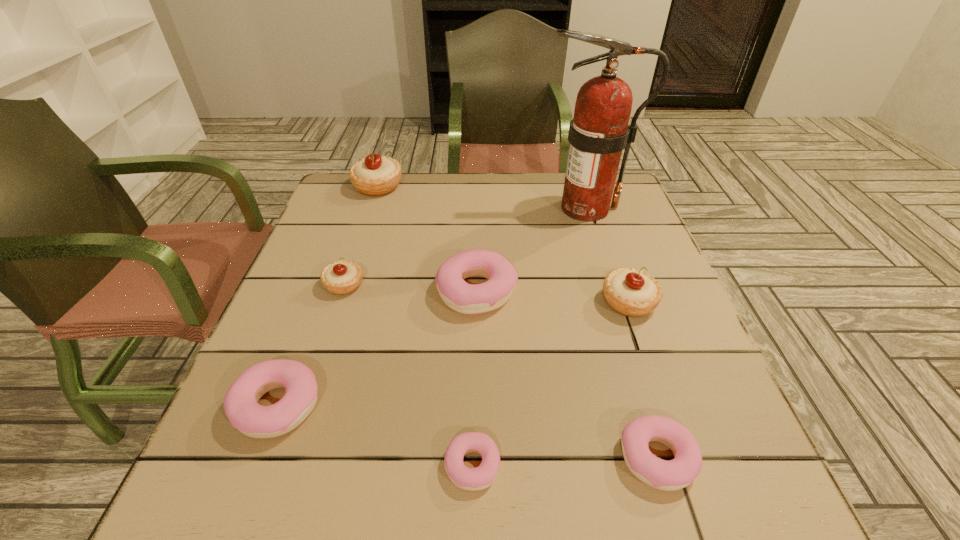
Find the location of `free location located 0.320m on the back of the farthest pink pastry`. free location located 0.320m on the back of the farthest pink pastry is located at coordinates (477, 194).

Locate an element on the screen. The height and width of the screenshot is (540, 960). free spot located on the right of the leftmost pink pastry is located at coordinates (436, 406).

This screenshot has width=960, height=540. In order to click on vacant space situated on the right of the second shortest object in this screenshot , I will do `click(757, 458)`.

You are a GUI agent. You are given a task and a screenshot of the screen. Output one action in this format:
    pyautogui.click(x=<x>, y=<y>)
    Task: Click on the vacant space located on the left of the shortest pastry
    The image size is (960, 540).
    Given the screenshot: What is the action you would take?
    pyautogui.click(x=349, y=465)

Find the location of a particular element. This screenshot has width=960, height=540. fire extinguisher that is at the far edge is located at coordinates [x=599, y=131].

Find the location of `pastry present at the far edge`. pastry present at the far edge is located at coordinates (373, 176).

You are a GUI agent. You are given a task and a screenshot of the screen. Output one action in this format:
    pyautogui.click(x=<x>, y=<y>)
    Task: Click on the fire extinguisher that is at the right edge
    The image size is (960, 540).
    Given the screenshot: What is the action you would take?
    pyautogui.click(x=599, y=131)

Identify the location of object that is at the far left corner. Image resolution: width=960 pixels, height=540 pixels. (373, 176).

Where is `object that is at the far right corner`? The image size is (960, 540). object that is at the far right corner is located at coordinates pyautogui.click(x=599, y=131).

Where is `object that is at the near right corner`? object that is at the near right corner is located at coordinates (675, 474).